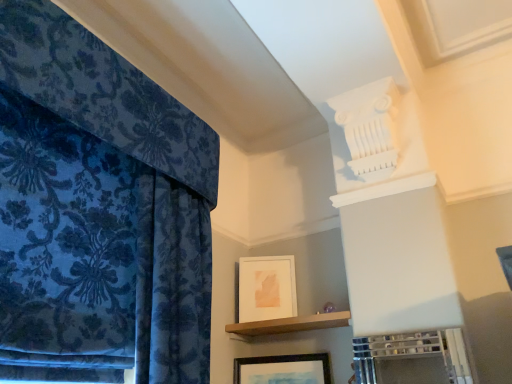
Question: Considering the positions of point (117, 109) and point (245, 332), is point (117, 109) closer or farther from the camera than point (245, 332)?

Choices:
 (A) closer
 (B) farther

Answer: (A)

Question: Is velvet blue curtain at left wider or thinner than brown wooden shelf at center?

Choices:
 (A) thin
 (B) wide

Answer: (B)

Question: Estimate the real-world distances between objects in this image. Which object is closer to the velvet blue curtain at left?

Choices:
 (A) wooden framed picture at lower center, which is counted as the first picture frame, starting from the front
 (B) white matte picture frame at upper center, the first picture frame from the back
 (C) brown wooden shelf at center

Answer: (B)

Question: Which object is the farthest from the velvet blue curtain at left?

Choices:
 (A) white matte picture frame at upper center, acting as the 1th picture frame starting from the top
 (B) wooden framed picture at lower center, the second picture frame in the top-to-bottom sequence
 (C) brown wooden shelf at center

Answer: (B)